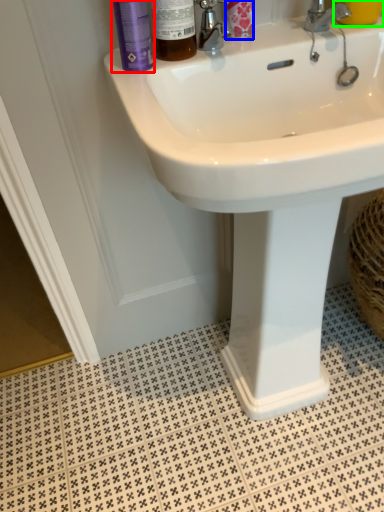
Question: Which object is the closest to the mouthwash (highlighted by a red box)? Choose among these: toiletry (highlighted by a blue box) or liquid (highlighted by a green box).

Choices:
 (A) toiletry
 (B) liquid

Answer: (A)